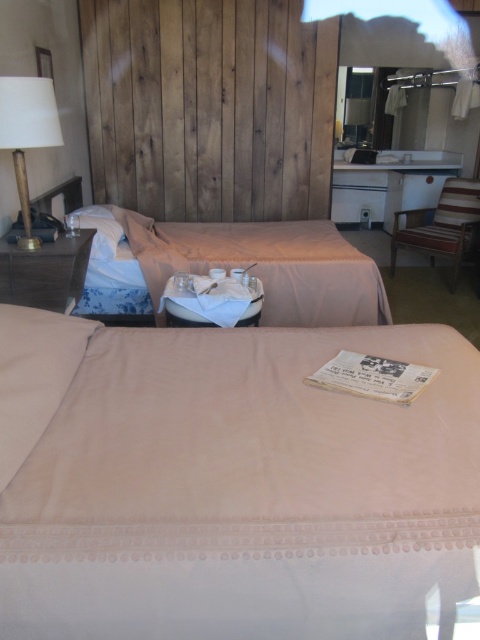
You are a guest in this hotel room and want to place your suitcase on the floor next to the beige fabric bed at center. Considering the size of the matte gold lamp at upper left, will there be enough space for your suitcase?

The beige fabric bed at center is larger in size than the matte gold lamp at upper left, so there should be sufficient space next to the bed for your suitcase since the lamp is smaller and positioned at the upper left.

You are a hotel guest who needs to choose between the pink fabric bed at lower center and the beige fabric bed at center for a nap. Which bed would you recommend if you prefer more space around you?

The beige fabric bed at center occupies more space than the pink fabric bed at lower center, so it would be better to choose the beige fabric bed at center for more space around you.